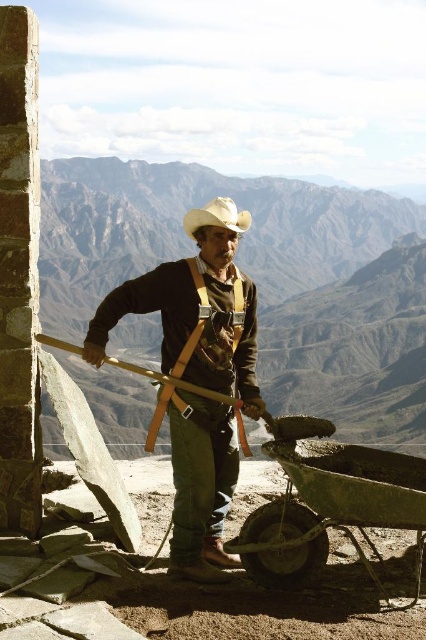
In the scene shown: Does green concrete at lower center have a greater width compared to wooden at left?

Incorrect, green concrete at lower center's width does not surpass wooden at left's.

Who is taller, green concrete at lower center or wooden at left?

With more height is wooden at left.

Is point (356, 497) closer to viewer compared to point (58, 346)?

Yes, it is in front of point (58, 346).

You are a GUI agent. You are given a task and a screenshot of the screen. Output one action in this format:
    pyautogui.click(x=<x>, y=<y>)
    Task: Click on the green concrete at lower center
    The width and height of the screenshot is (426, 640).
    Given the screenshot: What is the action you would take?
    pyautogui.click(x=331, y=509)

Can you confirm if brown leather harness at center is shorter than green concrete at lower center?

No, brown leather harness at center is not shorter than green concrete at lower center.

Based on the photo, measure the distance from brown leather harness at center to green concrete at lower center.

A distance of 1.55 meters exists between brown leather harness at center and green concrete at lower center.

You are a GUI agent. You are given a task and a screenshot of the screen. Output one action in this format:
    pyautogui.click(x=<x>, y=<y>)
    Task: Click on the brown leather harness at center
    The height and width of the screenshot is (640, 426).
    Given the screenshot: What is the action you would take?
    pyautogui.click(x=193, y=317)

Which is more to the right, brown leather harness at center or white matte cowboy hat at center?

brown leather harness at center is more to the right.

Who is taller, brown leather harness at center or white matte cowboy hat at center?

white matte cowboy hat at center

Is point (175, 280) farther from viewer compared to point (247, 227)?

That is True.

In order to click on brown leather harness at center in this screenshot , I will do `click(193, 317)`.